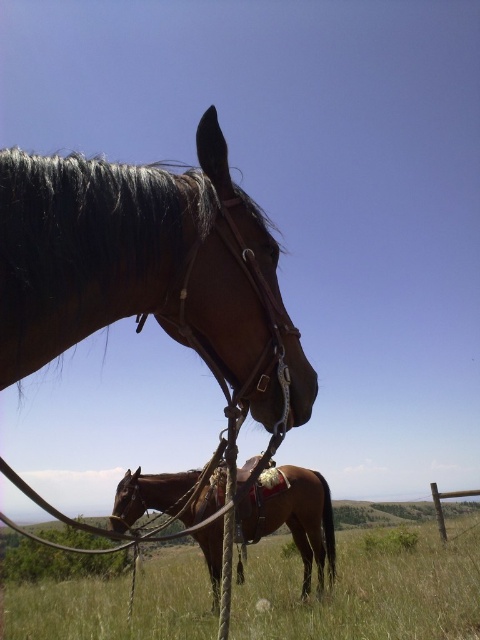
In the scene shown: Is green grass at lower center bigger than brown leather saddle at center?

No.

The image size is (480, 640). What do you see at coordinates (368, 589) in the screenshot?
I see `green grass at lower center` at bounding box center [368, 589].

This screenshot has height=640, width=480. I want to click on green grass at lower center, so [x=368, y=589].

Which is behind, point (197, 208) or point (372, 624)?

The point (372, 624) is more distant.

Image resolution: width=480 pixels, height=640 pixels. I want to click on brown leather bridle at center, so click(x=144, y=266).

Between point (44, 176) and point (368, 556), which one is positioned in front?

Point (44, 176) is more forward.

Identify the location of brown leather bridle at center. (144, 266).

Does brown leather bridle at center have a lesser width compared to brown leather saddle at center?

Correct, brown leather bridle at center's width is less than brown leather saddle at center's.

Which is more to the left, brown leather bridle at center or brown leather saddle at center?

brown leather bridle at center

Locate an element on the screen. Image resolution: width=480 pixels, height=640 pixels. brown leather bridle at center is located at coordinates (144, 266).